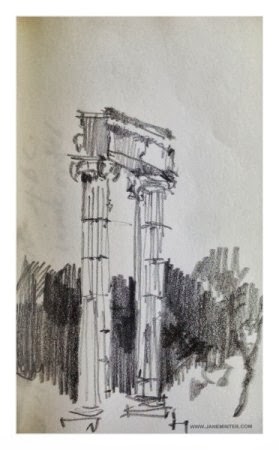
You are a GUI agent. You are given a task and a screenshot of the screen. Output one action in this format:
    pyautogui.click(x=<x>, y=<y>)
    Task: Click on the doorway
    
    Given the screenshot: What is the action you would take?
    pyautogui.click(x=125, y=363)